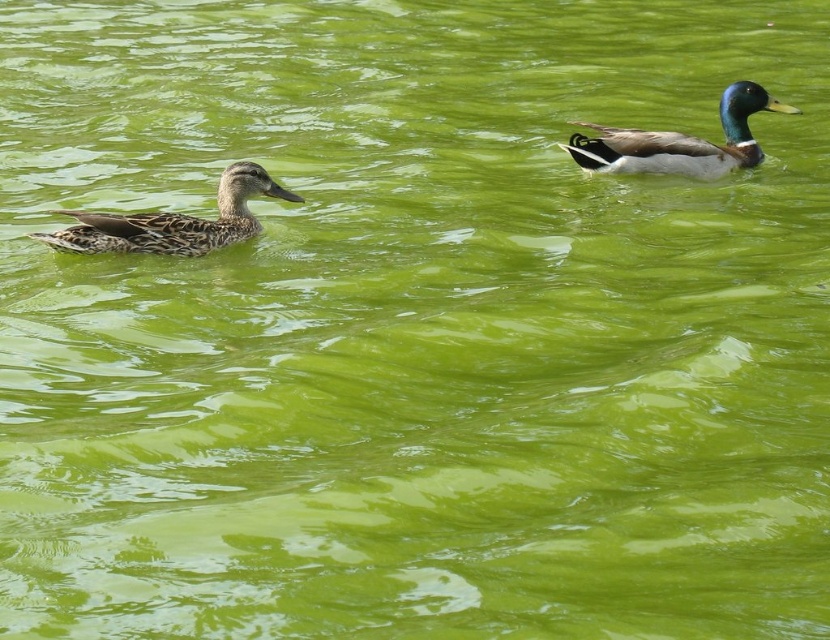
You are a photographer trying to capture both the speckled brown duck at left and the shiny green and brown duck at upper right in a single shot. Based on their positions, which duck would appear closer to the camera in the photo?

The speckled brown duck at left would appear closer to the camera because it is positioned in front of the shiny green and brown duck at upper right.

You are a photographer trying to capture both the speckled brown duck at left and the shiny green and brown duck at upper right in the same frame. Based on their positions, which duck would you focus on first to ensure both are in the shot?

The speckled brown duck at left is positioned on the left side of the shiny green and brown duck at upper right, so focusing on the shiny green and brown duck at upper right first would allow you to frame both ducks effectively.